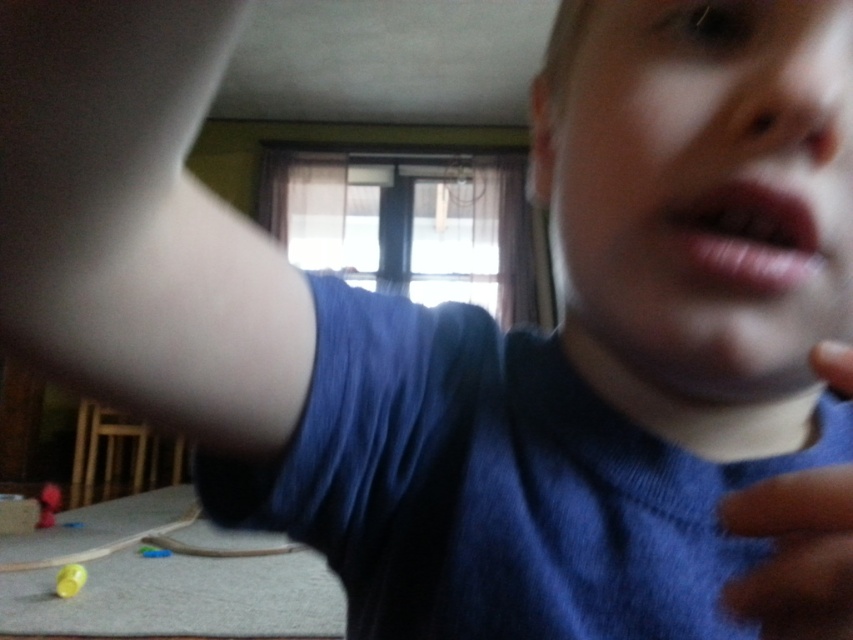
Can you confirm if blue fabric hand at lower right is taller than pink matte lips at center?

Yes.

Between point (811, 472) and point (763, 244), which one is positioned in front?

Positioned in front is point (811, 472).

Where is `blue fabric hand at lower right`? This screenshot has height=640, width=853. blue fabric hand at lower right is located at coordinates (795, 554).

Does blue fabric hand at lower right come in front of shiny yellow ball at lower left?

Yes, blue fabric hand at lower right is in front of shiny yellow ball at lower left.

Is point (827, 605) positioned after point (73, 582)?

No.

At what (x,y) coordinates should I click in order to perform the action: click on blue fabric hand at lower right. Please return your answer as a coordinate pair (x, y). Looking at the image, I should click on (795, 554).

Does shiny yellow ball at lower left appear on the left side of rubberized red ball at lower left?

No, shiny yellow ball at lower left is not to the left of rubberized red ball at lower left.

Who is shorter, shiny yellow ball at lower left or rubberized red ball at lower left?

shiny yellow ball at lower left

Describe the element at coordinates (68, 579) in the screenshot. I see `shiny yellow ball at lower left` at that location.

Find the location of `shiny yellow ball at lower left`. shiny yellow ball at lower left is located at coordinates [x=68, y=579].